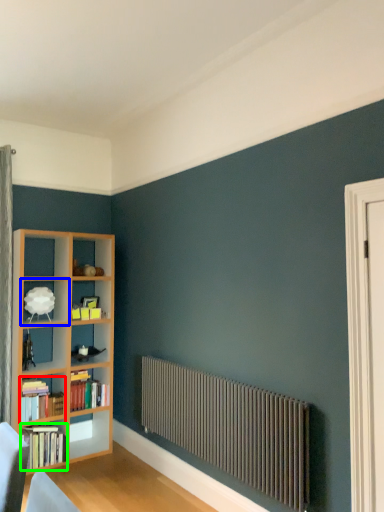
Question: Estimate the real-world distances between objects in this image. Which object is closer to book (highlighted by a red box), shelf (highlighted by a blue box) or book (highlighted by a green box)?

Choices:
 (A) shelf
 (B) book

Answer: (B)